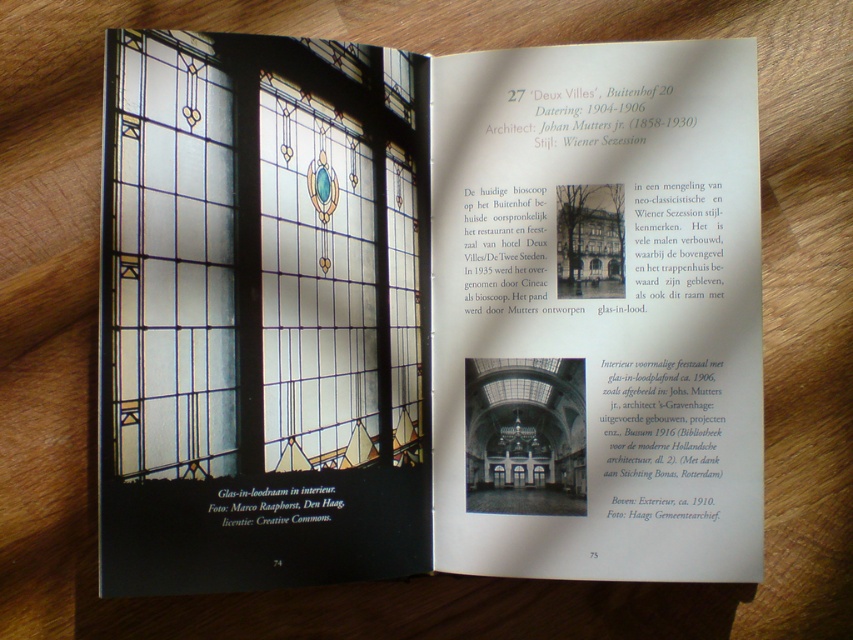
Does stained glass window at upper left have a lesser width compared to clear stained glass at center?

Incorrect, stained glass window at upper left's width is not less than clear stained glass at center's.

Which is in front, point (675, 488) or point (117, 324)?

Point (117, 324) is in front.

Locate an element on the screen. This screenshot has width=853, height=640. stained glass window at upper left is located at coordinates (428, 314).